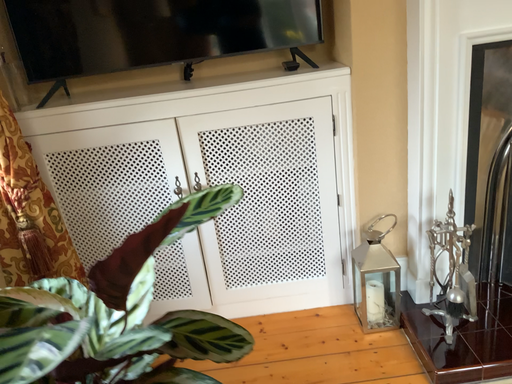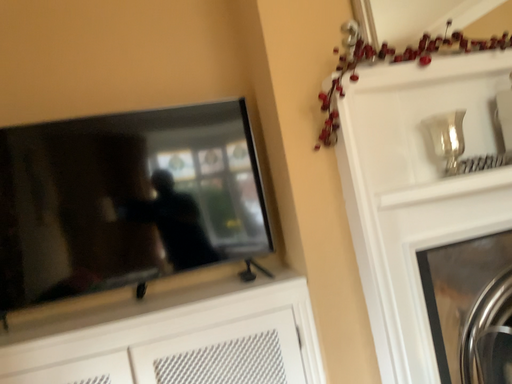
Question: Which way did the camera rotate in the video?

Choices:
 (A) rotated downward
 (B) rotated upward

Answer: (B)